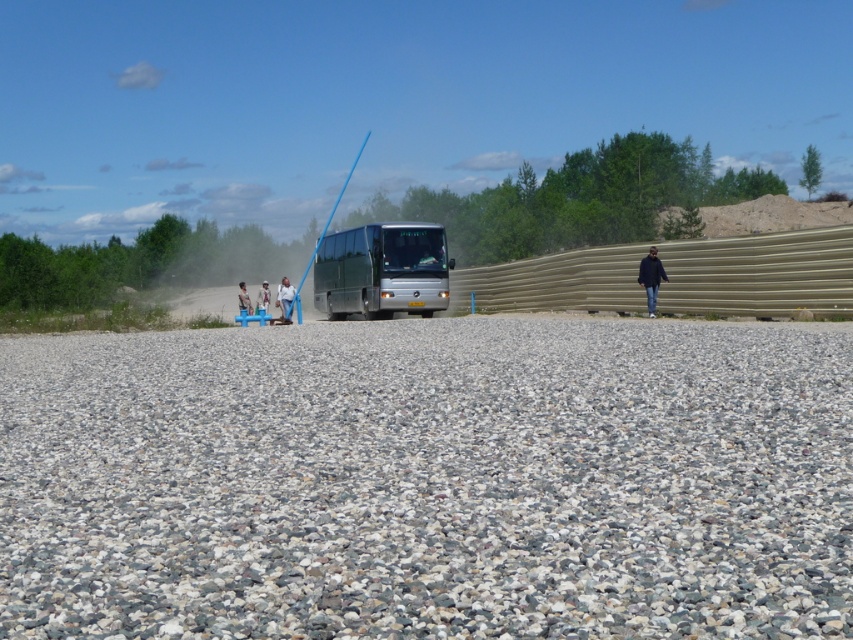
You are a delivery person trying to decide whether to park your van on the gray gravel at center. The van requires a surface that is at least as high as the black matte jacket at center to avoid sinking. Can you park your van there?

The gray gravel at center is shorter than the black matte jacket at center, so the gravel is not high enough to support the van. You should choose a different location to park.

You are standing in the construction area and want to move from the point at coordinates (x=314, y=296) to the point at (x=250, y=310). Which direction should you move relative to your current position?

You should move towards the lower right direction because point (x=250, y=310) is closer to the viewer than point (x=314, y=296), meaning it is located lower and to the right in the image.

You are a pedestrian standing on the gravelly surface in the foreground. You see the silver metallic bus at center and the light brown leather jacket at center. Which object is closer to you?

The silver metallic bus at center is closer to you because it is in front of the light brown leather jacket at center.